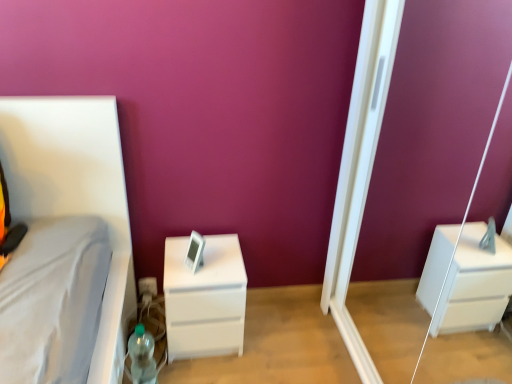
Question: From the image's perspective, does white glossy screen door at right appear lower than white matte chest of drawers at center?

Choices:
 (A) yes
 (B) no

Answer: (B)

Question: Does white glossy screen door at right have a smaller size compared to white matte chest of drawers at center?

Choices:
 (A) yes
 (B) no

Answer: (B)

Question: Does white glossy screen door at right have a greater width compared to white matte chest of drawers at center?

Choices:
 (A) yes
 (B) no

Answer: (B)

Question: Is white glossy screen door at right thinner than white matte chest of drawers at center?

Choices:
 (A) yes
 (B) no

Answer: (A)

Question: Are white glossy screen door at right and white matte chest of drawers at center making contact?

Choices:
 (A) no
 (B) yes

Answer: (A)

Question: In terms of size, does translucent plastic bottle at lower left appear bigger or smaller than white matte chest of drawers at center?

Choices:
 (A) big
 (B) small

Answer: (B)

Question: In terms of height, does translucent plastic bottle at lower left look taller or shorter compared to white matte chest of drawers at center?

Choices:
 (A) tall
 (B) short

Answer: (B)

Question: Do you think translucent plastic bottle at lower left is within white matte chest of drawers at center, or outside of it?

Choices:
 (A) outside
 (B) inside

Answer: (A)

Question: From the image's perspective, is translucent plastic bottle at lower left located above or below white matte chest of drawers at center?

Choices:
 (A) above
 (B) below

Answer: (B)

Question: Is translucent plastic bottle at lower left taller or shorter than white glossy screen door at right?

Choices:
 (A) short
 (B) tall

Answer: (A)

Question: Looking at their shapes, would you say translucent plastic bottle at lower left is wider or thinner than white glossy screen door at right?

Choices:
 (A) wide
 (B) thin

Answer: (B)

Question: Is point (133, 350) closer or farther from the camera than point (352, 87)?

Choices:
 (A) closer
 (B) farther

Answer: (B)

Question: Considering the relative positions of translucent plastic bottle at lower left and white glossy screen door at right in the image provided, is translucent plastic bottle at lower left to the left or to the right of white glossy screen door at right?

Choices:
 (A) right
 (B) left

Answer: (B)

Question: Would you say white matte chest of drawers at center is to the left or to the right of translucent plastic bottle at lower left in the picture?

Choices:
 (A) left
 (B) right

Answer: (B)

Question: From a real-world perspective, is white matte chest of drawers at center above or below translucent plastic bottle at lower left?

Choices:
 (A) above
 (B) below

Answer: (A)